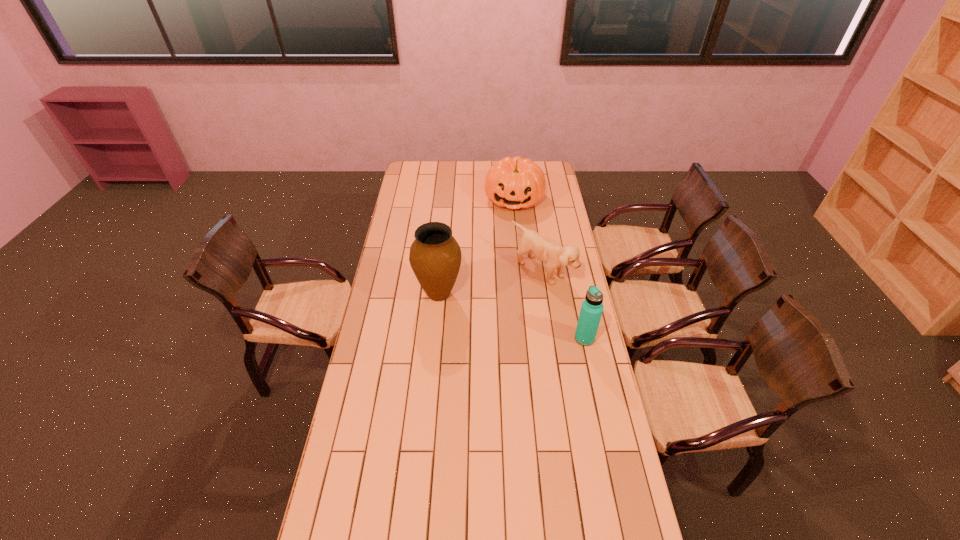
The width and height of the screenshot is (960, 540). What are the coordinates of `vacant point located between the leftmost object and the puppy` in the screenshot? It's located at (492, 282).

Locate an element on the screen. The height and width of the screenshot is (540, 960). free spot between the puppy and the nearest object is located at coordinates (564, 305).

Locate an element on the screen. This screenshot has width=960, height=540. free space between the farthest object and the leftmost object is located at coordinates (476, 246).

At what (x,y) coordinates should I click in order to perform the action: click on free space between the urn and the water bottle. Please return your answer as a coordinate pair (x, y). Looking at the image, I should click on (512, 316).

Locate an element on the screen. The image size is (960, 540). free spot between the urn and the puppy is located at coordinates (492, 282).

Find the location of `vacant area that lies between the water bottle and the puppy`. vacant area that lies between the water bottle and the puppy is located at coordinates (564, 305).

Identify which object is the second closest to the nearest object. Please provide its 2D coordinates. Your answer should be formatted as a tuple, i.e. [(x, y)], where the tuple contains the x and y coordinates of a point satisfying the conditions above.

[(435, 256)]

Choose which object is the second nearest neighbor to the urn. Please provide its 2D coordinates. Your answer should be formatted as a tuple, i.e. [(x, y)], where the tuple contains the x and y coordinates of a point satisfying the conditions above.

[(592, 307)]

Find the location of `free location that satisfies the following two spatial constraints: 1. on the back side of the tallest object; 2. on the right side of the puppy`. free location that satisfies the following two spatial constraints: 1. on the back side of the tallest object; 2. on the right side of the puppy is located at coordinates (441, 271).

Locate an element on the screen. This screenshot has height=540, width=960. blank area in the image that satisfies the following two spatial constraints: 1. on the front side of the farthest object; 2. on the right side of the nearest object is located at coordinates point(528,339).